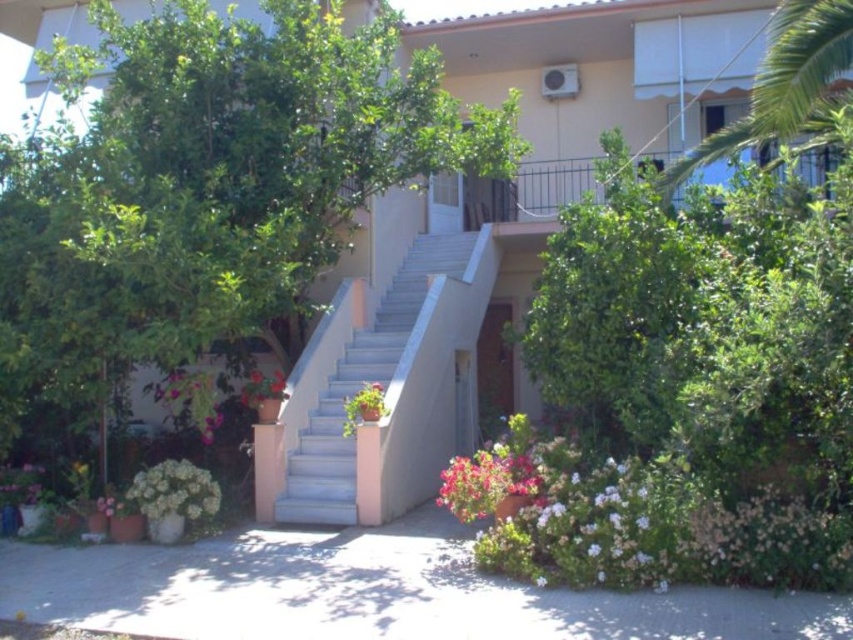
You are a gardener looking to water the plants in the residential area. You have a watering can and need to reach both the vivid pink petals at lower center and the white matte flowers at lower left. Which plant should you water first if you start from the left side of the stairs?

You should water the white matte flowers at lower left first because they are positioned to the left of the vivid pink petals at lower center, making them closer to your starting point.